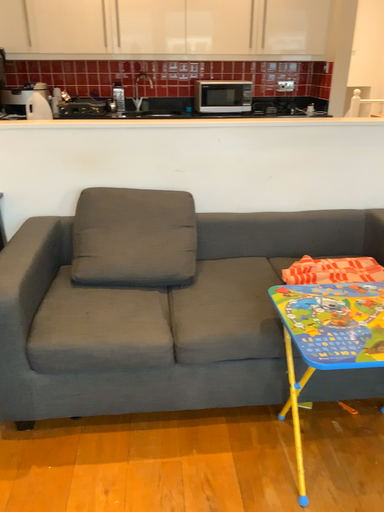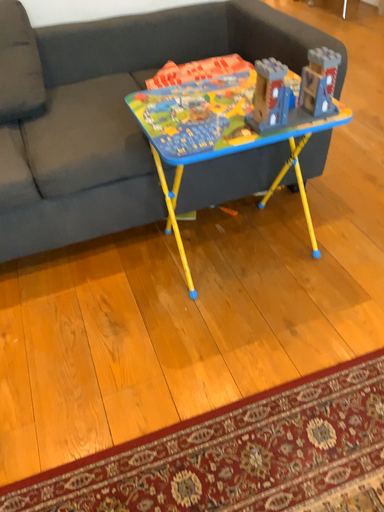
Question: How did the camera likely rotate when shooting the video?

Choices:
 (A) rotated right
 (B) rotated left

Answer: (A)